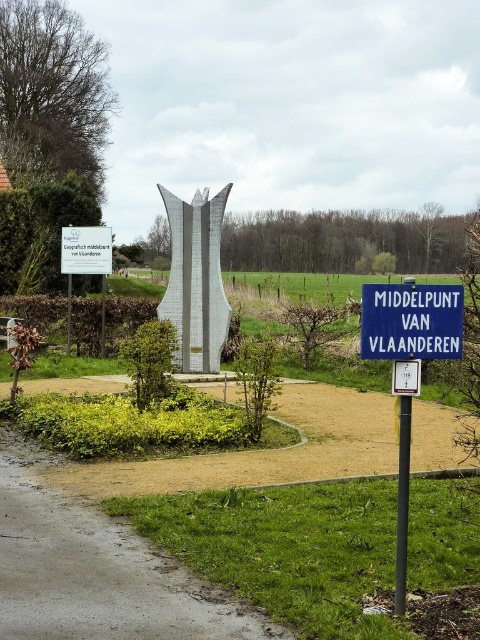
Question: Which point is farther from the camera taking this photo?

Choices:
 (A) (208, 310)
 (B) (62, 545)

Answer: (A)

Question: Which of the following is the closest to the observer?

Choices:
 (A) (108, 257)
 (B) (408, 385)
 (C) (443, 416)
 (D) (169, 278)

Answer: (B)

Question: Observing the image, what is the correct spatial positioning of silver metallic sculpture at center in reference to white plastic parking sign at center?

Choices:
 (A) right
 (B) left

Answer: (B)

Question: Which point is closer to the camera?

Choices:
 (A) (199, 620)
 (B) (375, 289)

Answer: (B)

Question: Can you confirm if silver metallic sculpture at center is wider than white plastic sign at upper center?

Choices:
 (A) yes
 (B) no

Answer: (B)

Question: In this image, where is silver metallic sculpture at center located relative to blue plastic sign at center?

Choices:
 (A) above
 (B) below

Answer: (B)